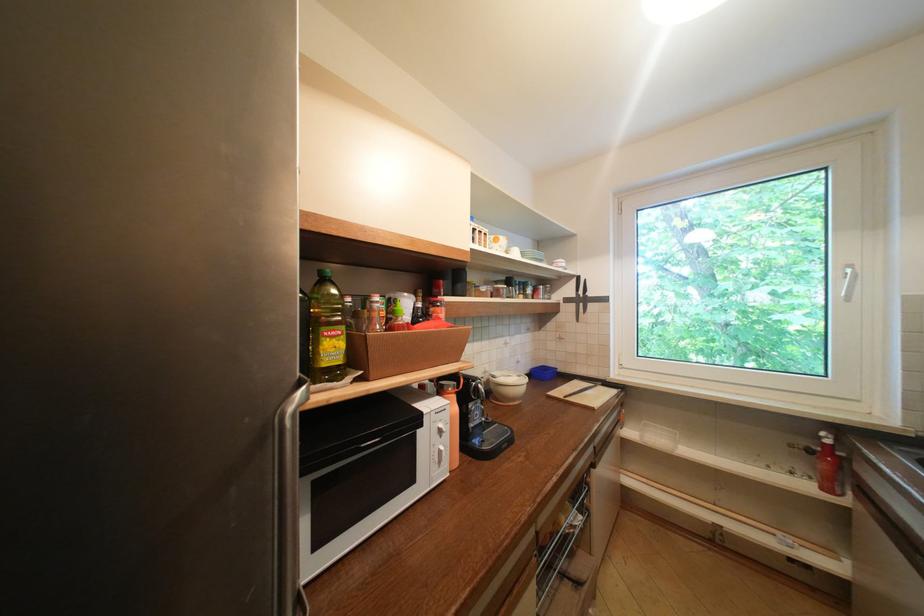
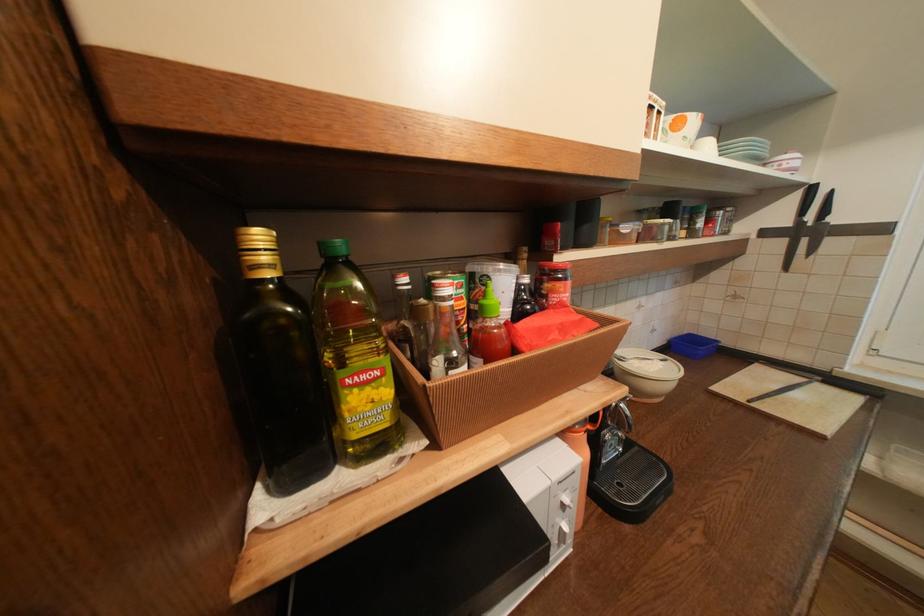
Where in the second image is the point corresponding to (x=590, y=306) from the first image?

(812, 241)